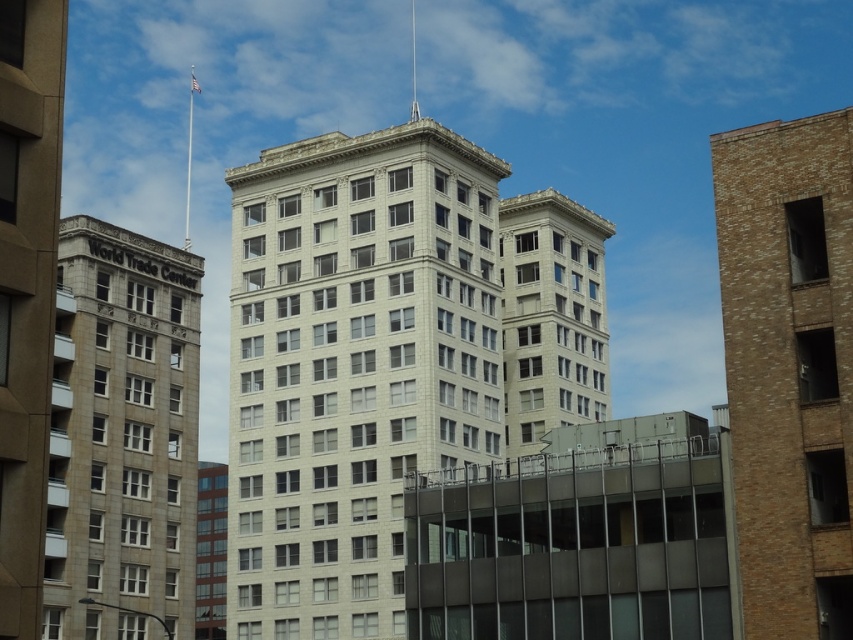
Question: Which point is closer to the camera?

Choices:
 (A) gray stone building at left
 (B) brown brick building at right

Answer: (A)

Question: From the image, what is the correct spatial relationship of gray stone building at left in relation to white stone building at center?

Choices:
 (A) left
 (B) right

Answer: (A)

Question: Can you confirm if gray stone building at left is smaller than white stone building at center?

Choices:
 (A) yes
 (B) no

Answer: (B)

Question: Which object is the farthest from the brown brick building at right?

Choices:
 (A) white stone building at center
 (B) gray stone building at left

Answer: (A)

Question: Which point appears closest to the camera in this image?

Choices:
 (A) (129, 396)
 (B) (819, 138)
 (C) (520, 342)

Answer: (B)

Question: Does brown brick building at right have a larger size compared to gray stone building at left?

Choices:
 (A) no
 (B) yes

Answer: (A)